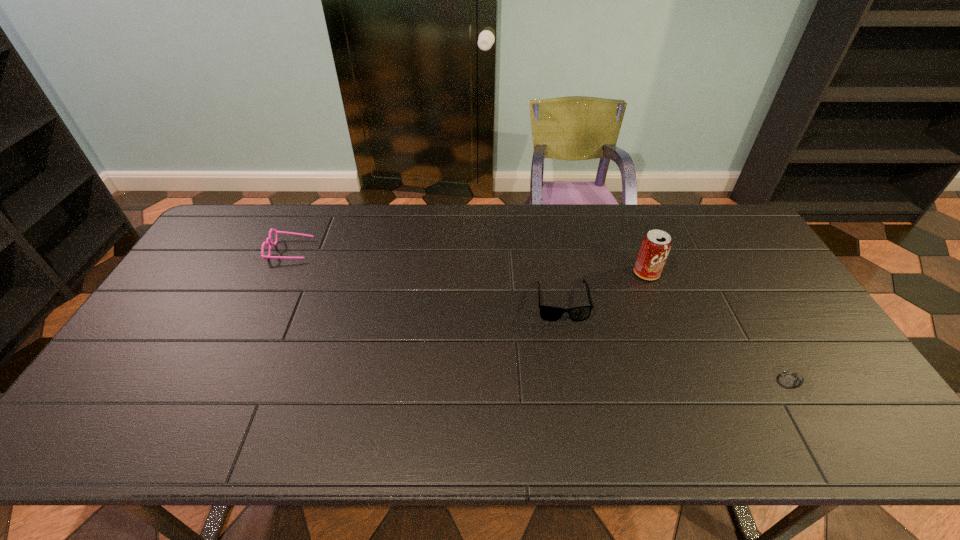
At what (x,y) coordinates should I click in order to perform the action: click on vacant space that satisfies the following two spatial constraints: 1. on the arms of the farthest object; 2. on the back side of the soda can. Please return your answer as a coordinate pair (x, y). The image size is (960, 540). Looking at the image, I should click on (280, 273).

Image resolution: width=960 pixels, height=540 pixels. Find the location of `free space in the image that satisfies the following two spatial constraints: 1. on the back side of the soda can; 2. on the arms of the spectacles`. free space in the image that satisfies the following two spatial constraints: 1. on the back side of the soda can; 2. on the arms of the spectacles is located at coordinates (637, 250).

Where is `blank area in the image that satisfies the following two spatial constraints: 1. on the arms of the spectacles; 2. on the left side of the soda can`? The width and height of the screenshot is (960, 540). blank area in the image that satisfies the following two spatial constraints: 1. on the arms of the spectacles; 2. on the left side of the soda can is located at coordinates (280, 273).

This screenshot has width=960, height=540. Find the location of `blank area in the image that satisfies the following two spatial constraints: 1. on the arms of the farthest object; 2. on the right side of the second object from right to left`. blank area in the image that satisfies the following two spatial constraints: 1. on the arms of the farthest object; 2. on the right side of the second object from right to left is located at coordinates (280, 273).

The image size is (960, 540). Identify the location of free spot that satisfies the following two spatial constraints: 1. on the back side of the soda can; 2. on the arms of the farthest object. (637, 250).

Locate an element on the screen. free space that satisfies the following two spatial constraints: 1. on the arms of the farthest object; 2. on the left side of the soda can is located at coordinates (280, 273).